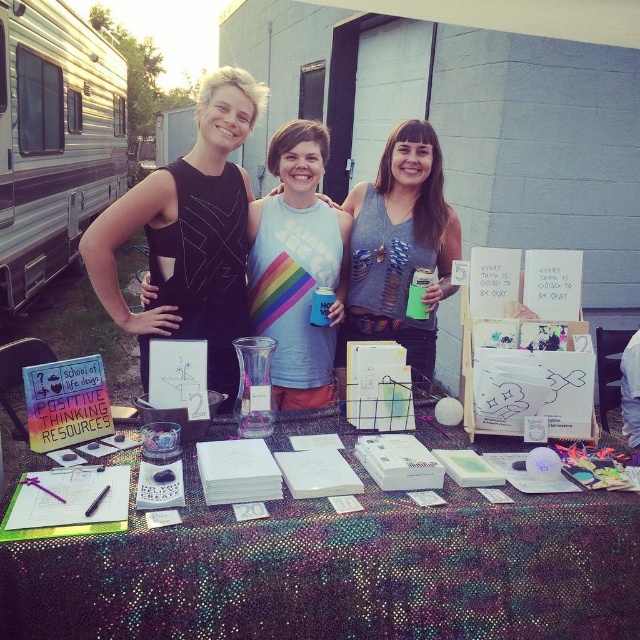
From the picture: Who is positioned more to the left, white paper at center or grayholey tank top at center?

From the viewer's perspective, white paper at center appears more on the left side.

Which is in front, point (461, 584) or point (440, 150)?

Point (461, 584)

You are a GUI agent. You are given a task and a screenshot of the screen. Output one action in this format:
    pyautogui.click(x=<x>, y=<y>)
    Task: Click on the white paper at center
    
    Given the screenshot: What is the action you would take?
    pyautogui.click(x=339, y=570)

From the picture: Between white paper at center and silver metallic recreational vehicle at left, which one has more height?

With more height is silver metallic recreational vehicle at left.

Is white paper at center positioned behind silver metallic recreational vehicle at left?

No, it is in front of silver metallic recreational vehicle at left.

The image size is (640, 640). Identify the location of white paper at center. (339, 570).

Is silver metallic recreational vehicle at left above grayholey tank top at center?

Correct, silver metallic recreational vehicle at left is located above grayholey tank top at center.

Can you confirm if silver metallic recreational vehicle at left is taller than grayholey tank top at center?

In fact, silver metallic recreational vehicle at left may be shorter than grayholey tank top at center.

Is point (19, 93) farther from viewer compared to point (410, 125)?

Yes, point (19, 93) is farther from viewer.

Find the location of a particular element. silver metallic recreational vehicle at left is located at coordinates (54, 140).